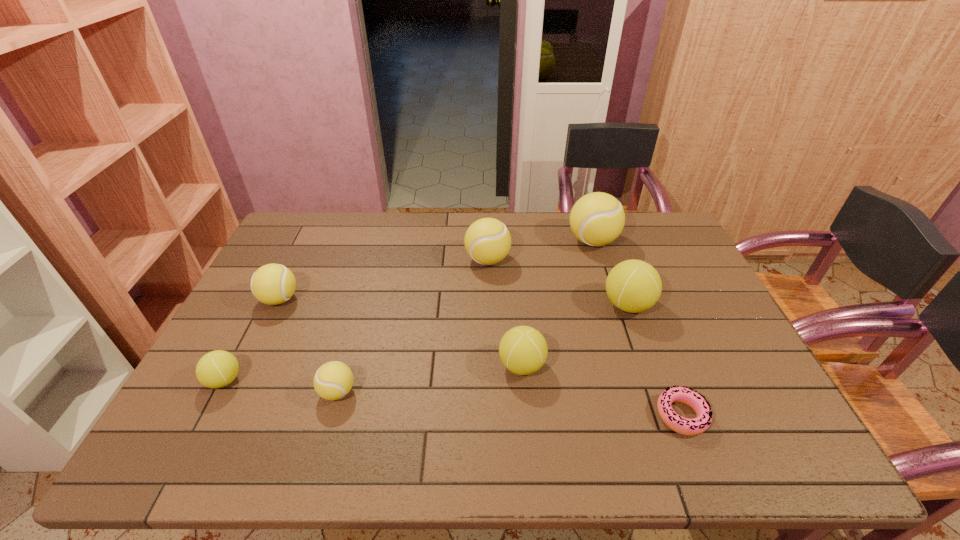
Image resolution: width=960 pixels, height=540 pixels. What are the coordinates of `yellow tennis ball that can be found as the third closest to the second green tennis ball from right to left` in the screenshot? It's located at (596, 219).

Point out which green tennis ball is positioned as the third nearest to the second yellow tennis ball from right to left. Please provide its 2D coordinates. Your answer should be formatted as a tuple, i.e. [(x, y)], where the tuple contains the x and y coordinates of a point satisfying the conditions above.

[(218, 368)]

Identify which green tennis ball is the second closest to the farthest green tennis ball. Please provide its 2D coordinates. Your answer should be formatted as a tuple, i.e. [(x, y)], where the tuple contains the x and y coordinates of a point satisfying the conditions above.

[(218, 368)]

Where is `blank area in the image that satisfies the following two spatial constraints: 1. on the front side of the second yellow tennis ball from left to right; 2. on the left side of the third farthest yellow tennis ball`? This screenshot has width=960, height=540. blank area in the image that satisfies the following two spatial constraints: 1. on the front side of the second yellow tennis ball from left to right; 2. on the left side of the third farthest yellow tennis ball is located at coordinates (234, 392).

At what (x,y) coordinates should I click in order to perform the action: click on vacant space that satisfies the following two spatial constraints: 1. on the back side of the leftmost yellow tennis ball; 2. on the right side of the third smallest yellow tennis ball. Please return your answer as a coordinate pair (x, y). This screenshot has height=540, width=960. Looking at the image, I should click on (300, 260).

Locate an element on the screen. free space that satisfies the following two spatial constraints: 1. on the front side of the second smallest yellow tennis ball; 2. on the right side of the shortest object is located at coordinates (223, 415).

You are a GUI agent. You are given a task and a screenshot of the screen. Output one action in this format:
    pyautogui.click(x=<x>, y=<y>)
    Task: Click on the free space that satisfies the following two spatial constraints: 1. on the front side of the second smallest green tennis ball; 2. on the left side of the second biggest yellow tennis ball
    The height and width of the screenshot is (540, 960).
    Given the screenshot: What is the action you would take?
    pyautogui.click(x=490, y=366)